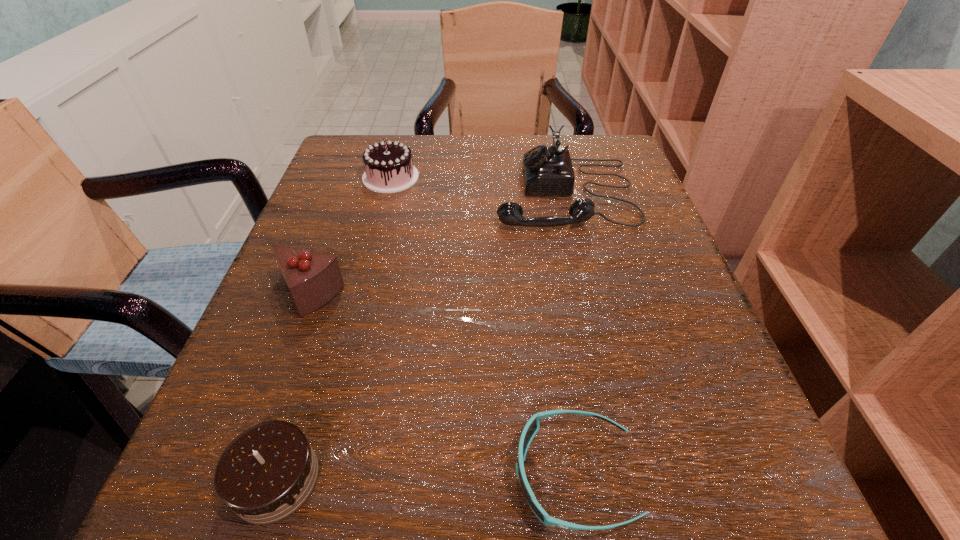
The image size is (960, 540). I want to click on object that is the second closest to the telephone, so click(313, 278).

Select which object is the third closest to the telephone. Please provide its 2D coordinates. Your answer should be formatted as a tuple, i.e. [(x, y)], where the tuple contains the x and y coordinates of a point satisfying the conditions above.

[(532, 426)]

Locate which chocolate cake is the second closest to the nearest chocolate cake. Please provide its 2D coordinates. Your answer should be formatted as a tuple, i.e. [(x, y)], where the tuple contains the x and y coordinates of a point satisfying the conditions above.

[(389, 168)]

Find the location of a particular element. The image size is (960, 540). the closest chocolate cake to the farthest chocolate cake is located at coordinates (313, 278).

This screenshot has width=960, height=540. Identify the location of free spot that satisfies the following two spatial constraints: 1. on the back side of the nearest chocolate cake; 2. on the right side of the farthest chocolate cake. (372, 177).

What are the coordinates of `free space in the image that satisfies the following two spatial constraints: 1. on the dial of the telephone; 2. on the front side of the nearest chocolate cake` in the screenshot? It's located at (632, 479).